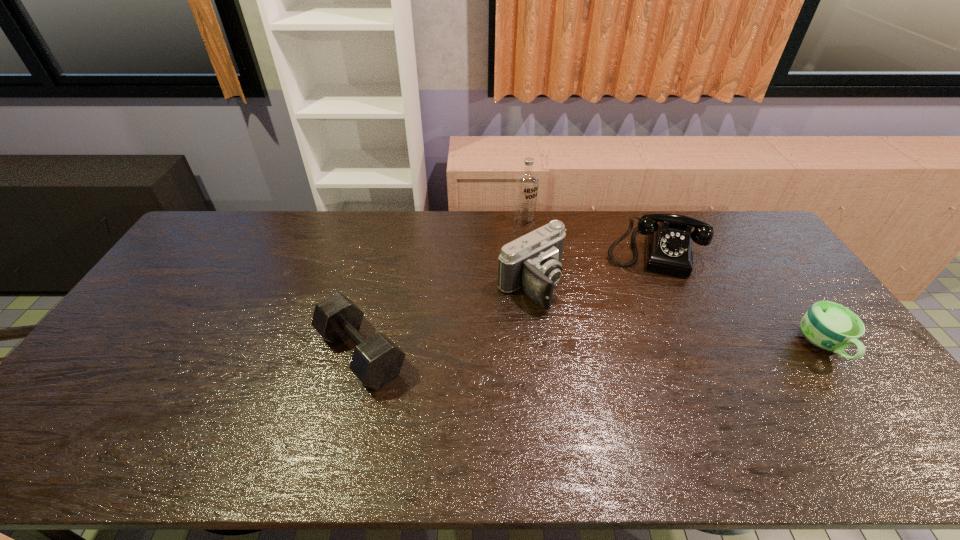
Locate an element on the screen. This screenshot has height=540, width=960. object that is at the near edge is located at coordinates (377, 360).

At what (x,y) coordinates should I click in order to perform the action: click on object that is positioned at the right edge. Please return your answer as a coordinate pair (x, y). The width and height of the screenshot is (960, 540). Looking at the image, I should click on 827,325.

Image resolution: width=960 pixels, height=540 pixels. In the image, there is a desktop. In order to click on blank space at the far edge in this screenshot , I will do `click(332, 234)`.

I want to click on vacant space at the near edge of the desktop, so click(x=188, y=406).

You are a GUI agent. You are given a task and a screenshot of the screen. Output one action in this format:
    pyautogui.click(x=<x>, y=<y>)
    Task: Click on the vacant space at the right edge
    The height and width of the screenshot is (540, 960).
    Given the screenshot: What is the action you would take?
    pyautogui.click(x=754, y=286)

Find the location of a particular element. blank space at the near right corner is located at coordinates (862, 420).

Identify the location of vacant region between the leftmost object and the telephone. (507, 302).

Image resolution: width=960 pixels, height=540 pixels. What are the coordinates of `vacant space that is in between the telephone and the rightmost object` in the screenshot? It's located at (738, 299).

Locate an element on the screen. The width and height of the screenshot is (960, 540). free space between the telephone and the fourth tallest object is located at coordinates (507, 302).

You are a GUI agent. You are given a task and a screenshot of the screen. Output one action in this format:
    pyautogui.click(x=<x>, y=<y>)
    Task: Click on the vacant area that lies between the vodka and the dumbbell
    
    Given the screenshot: What is the action you would take?
    pyautogui.click(x=443, y=288)